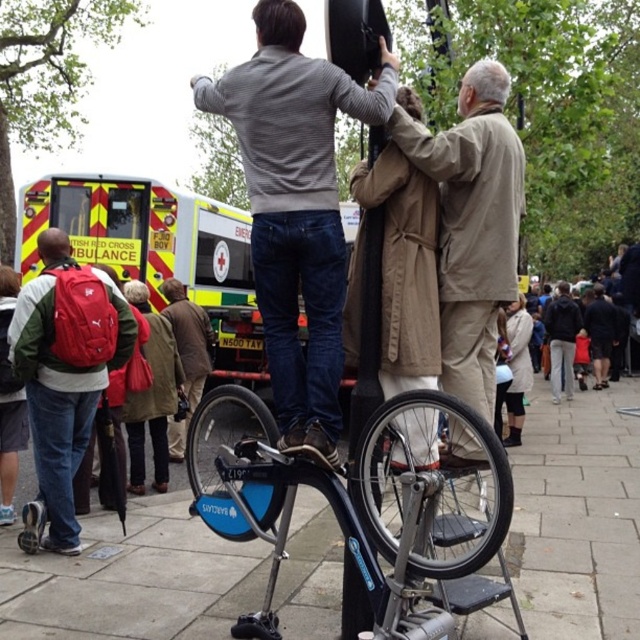
Question: Where is beige fabric coat at center located in relation to red fabric backpack at lower left in the image?

Choices:
 (A) above
 (B) below

Answer: (A)

Question: From the image, what is the correct spatial relationship of matte gray sweater at center in relation to red fabric backpack at lower left?

Choices:
 (A) above
 (B) below

Answer: (A)

Question: Estimate the real-world distances between objects in this image. Which object is closer to the yellow reflective plastic ambulance at upper left?

Choices:
 (A) matte black bicycle at center
 (B) matte gray sweater at center
 (C) beige fabric coat at center

Answer: (A)

Question: Based on their relative distances, which object is farther from the blue metallic bicycle at center?

Choices:
 (A) matte gray sweater at center
 (B) beige fabric coat at center

Answer: (B)

Question: Which object appears closest to the camera in this image?

Choices:
 (A) red fabric backpack at lower left
 (B) matte black bicycle at center

Answer: (A)

Question: In this image, where is yellow reflective plastic ambulance at upper left located relative to matte black bicycle at center?

Choices:
 (A) right
 (B) left

Answer: (B)